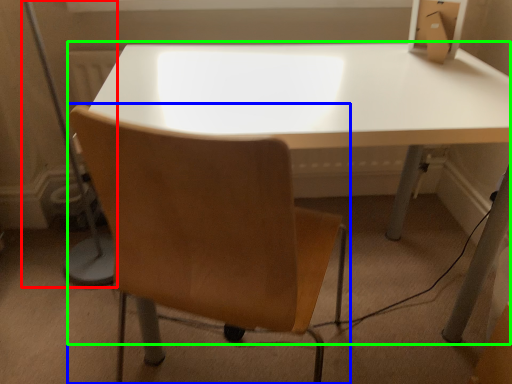
Question: Which is farther away from table lamp (highlighted by a red box)? chair (highlighted by a blue box) or table (highlighted by a green box)?

Choices:
 (A) chair
 (B) table

Answer: (A)